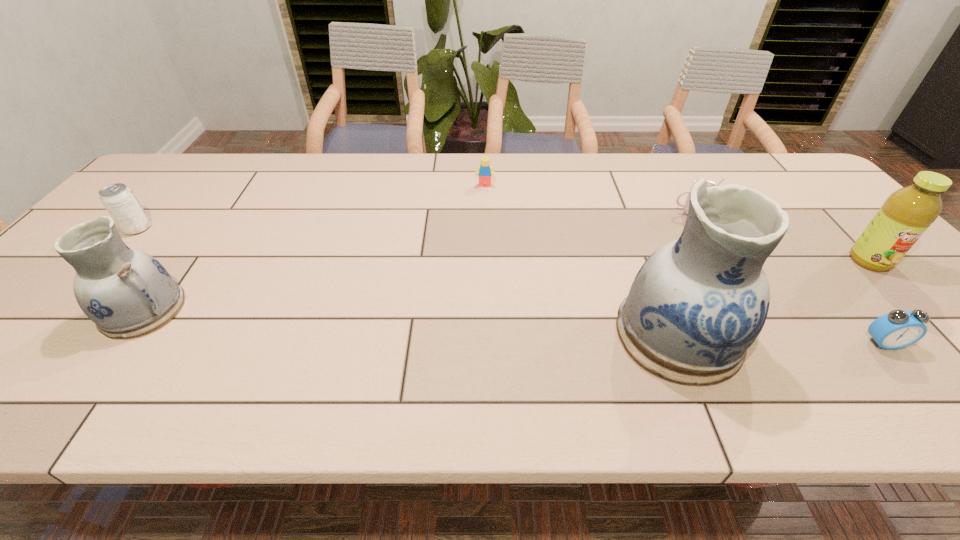
Please point a space for a new pottery to maintain equal intervals. Please provide its 2D coordinates. Your answer should be formatted as a tuple, i.e. [(x, y)], where the tuple contains the x and y coordinates of a point satisfying the conditions above.

[(404, 321)]